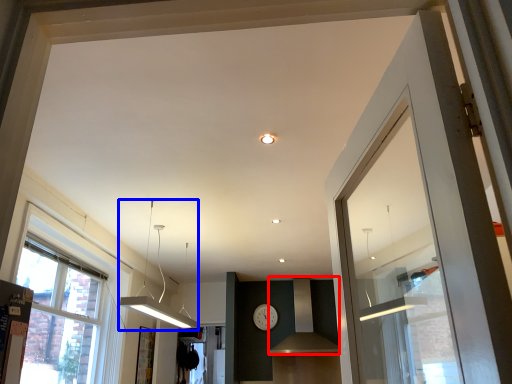
Question: Which object is closer to the camera taking this photo, vent (highlighted by a red box) or light fixture (highlighted by a blue box)?

Choices:
 (A) vent
 (B) light fixture

Answer: (B)